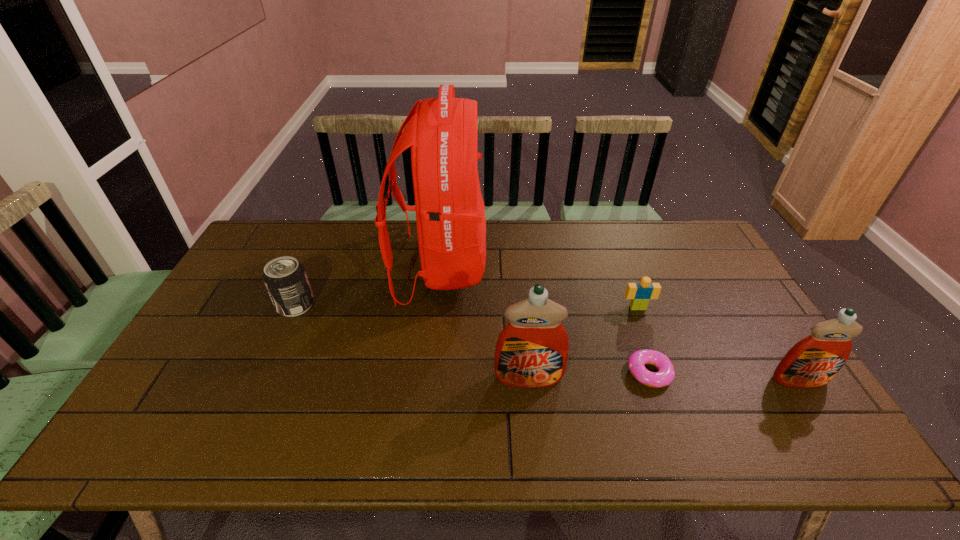
Locate an element on the screen. The height and width of the screenshot is (540, 960). vacant space located 0.060m on the front surface of the rightmost object is located at coordinates (820, 411).

Image resolution: width=960 pixels, height=540 pixels. I want to click on free point located 0.200m on the main compartment of the tallest object, so click(x=546, y=267).

Locate an element on the screen. free space located on the face of the fifth tallest object is located at coordinates coord(645,329).

This screenshot has width=960, height=540. Identify the location of free space located 0.250m on the front of the soda can. (256, 392).

Locate an element on the screen. This screenshot has width=960, height=540. free location located 0.260m on the right of the doughnut is located at coordinates (x=772, y=373).

Find the location of a particular element. object at the far edge is located at coordinates (442, 132).

Where is `doughnut located at the near edge`? Image resolution: width=960 pixels, height=540 pixels. doughnut located at the near edge is located at coordinates (638, 359).

Locate an element on the screen. object that is at the right edge is located at coordinates (812, 362).

Find the location of a particular element. The image size is (960, 540). object positioned at the near right corner is located at coordinates (812, 362).

Find the location of a particular element. This screenshot has height=540, width=960. free space at the far edge of the desktop is located at coordinates (347, 230).